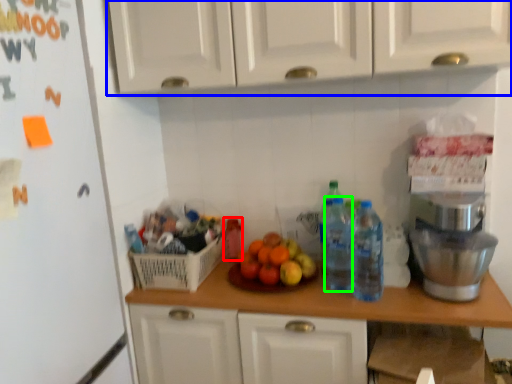
Question: Considering the real-world distances, which object is closest to bottle (highlighted by a red box)? cabinetry (highlighted by a blue box) or bottle (highlighted by a green box).

Choices:
 (A) cabinetry
 (B) bottle

Answer: (B)